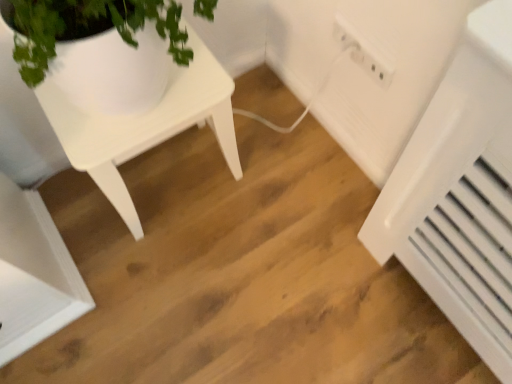
Question: Does white matte table at upper left have a lesser width compared to white plastic electric outlet at upper right?

Choices:
 (A) yes
 (B) no

Answer: (B)

Question: Is white matte table at upper left wider than white plastic electric outlet at upper right?

Choices:
 (A) yes
 (B) no

Answer: (A)

Question: From a real-world perspective, is white matte table at upper left over white plastic electric outlet at upper right?

Choices:
 (A) no
 (B) yes

Answer: (A)

Question: Is white matte table at upper left shorter than white plastic electric outlet at upper right?

Choices:
 (A) no
 (B) yes

Answer: (A)

Question: Is white matte table at upper left closer to camera compared to white plastic electric outlet at upper right?

Choices:
 (A) no
 (B) yes

Answer: (B)

Question: Is white plastic radiator at lower right wider or thinner than white matte table at upper left?

Choices:
 (A) wide
 (B) thin

Answer: (B)

Question: Is white plastic radiator at lower right to the left or to the right of white matte table at upper left in the image?

Choices:
 (A) right
 (B) left

Answer: (A)

Question: In the image, is white plastic radiator at lower right positioned in front of or behind white matte table at upper left?

Choices:
 (A) behind
 (B) front

Answer: (A)

Question: Is point (418, 281) closer or farther from the camera than point (105, 188)?

Choices:
 (A) closer
 (B) farther

Answer: (B)

Question: Considering the relative positions of white matte table at upper left and white plastic electric outlet at upper right in the image provided, is white matte table at upper left to the left or to the right of white plastic electric outlet at upper right?

Choices:
 (A) right
 (B) left

Answer: (B)

Question: From the image's perspective, is white matte table at upper left located above or below white plastic electric outlet at upper right?

Choices:
 (A) above
 (B) below

Answer: (B)

Question: From a real-world perspective, is white matte table at upper left above or below white plastic electric outlet at upper right?

Choices:
 (A) above
 (B) below

Answer: (B)

Question: Does point (103, 130) appear closer or farther from the camera than point (378, 84)?

Choices:
 (A) farther
 (B) closer

Answer: (B)

Question: Considering their positions, is white matte table at upper left located in front of or behind white plastic radiator at lower right?

Choices:
 (A) front
 (B) behind

Answer: (A)

Question: Is white matte table at upper left taller or shorter than white plastic radiator at lower right?

Choices:
 (A) short
 (B) tall

Answer: (B)